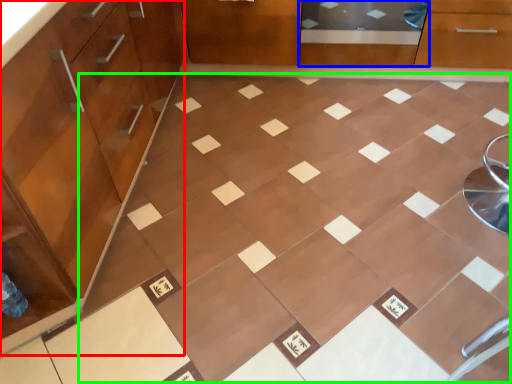
Question: Estimate the real-world distances between objects in this image. Which object is farther from cabinetry (highlighted by a red box), screen door (highlighted by a blue box) or ceramic tile (highlighted by a green box)?

Choices:
 (A) screen door
 (B) ceramic tile

Answer: (A)